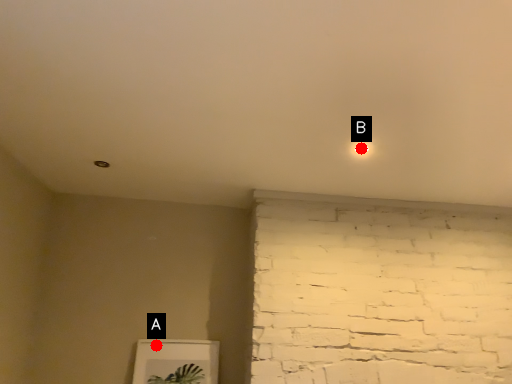
Question: Two points are circled on the image, labeled by A and B beside each circle. Among these points, which one is nearest to the camera?

Choices:
 (A) A is closer
 (B) B is closer

Answer: (B)